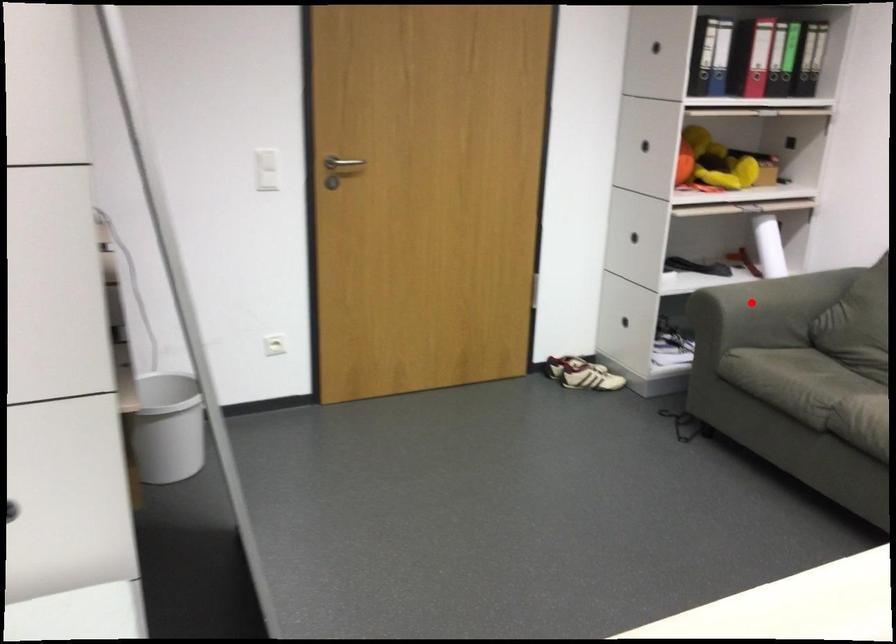
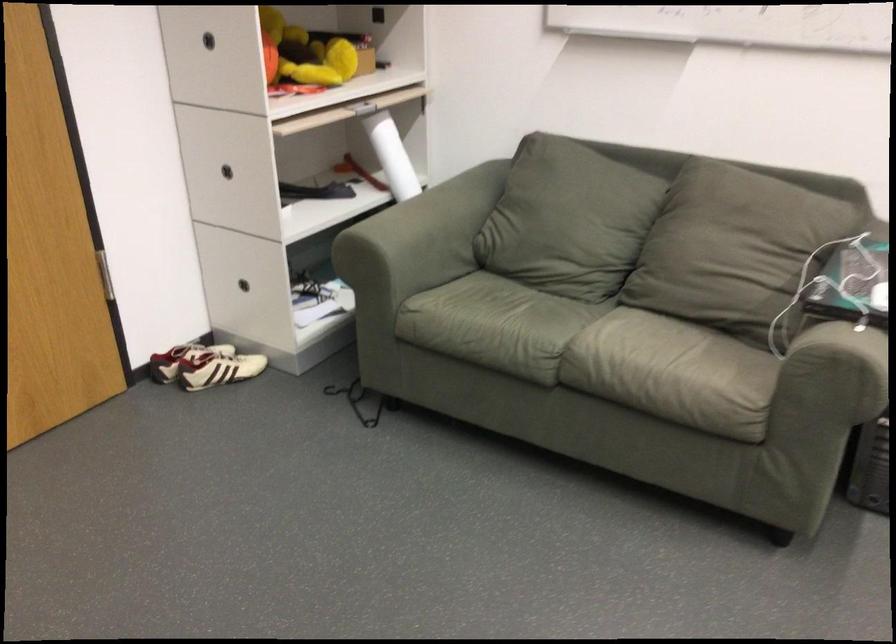
In the second image, find the point that corresponds to the highlighted location in the first image.

(416, 242)